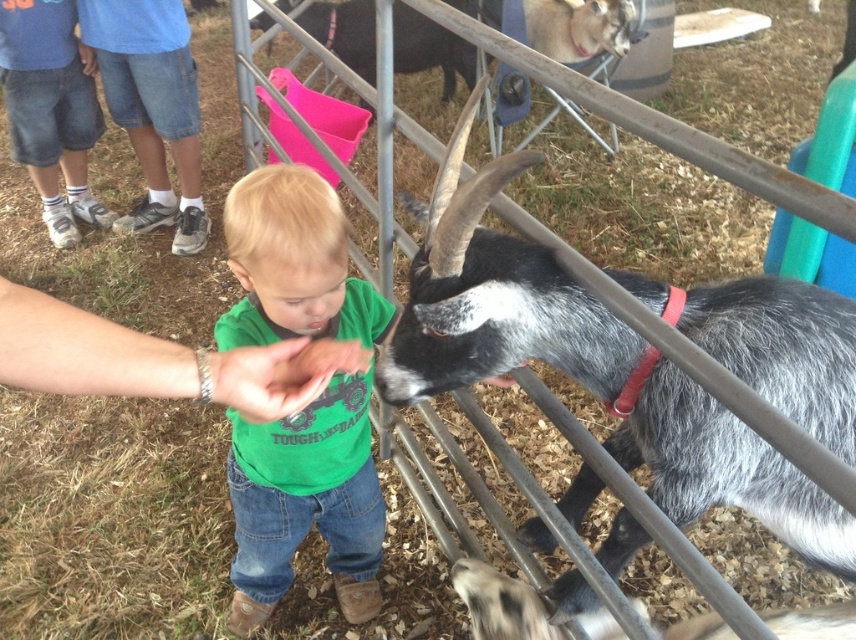
You are a photographer trying to capture a photo of the gray speckled fur at center and the green cotton shirt at center. Which object should you focus on first if you want to ensure both are in the frame without moving the camera?

You should focus on the gray speckled fur at center first because its width is larger than the green cotton shirt at center, so it will take up more space in the frame.

You are standing at the position of the child interacting with the goat. You want to walk to the point marked by point (310, 513). Which direction should you walk relative to the point (711, 451)?

You should walk towards the direction away from point (711, 451) because point (310, 513) is behind point (711, 451) from your current position.

You are a photographer at the petting zoo. You want to capture a photo that includes both the gray speckled fur at center and the green cotton shirt at center. Which object should you focus on first to ensure both are in frame?

You should focus on the gray speckled fur at center first since it is larger in size than the green cotton shirt at center, making it easier to frame both objects together.